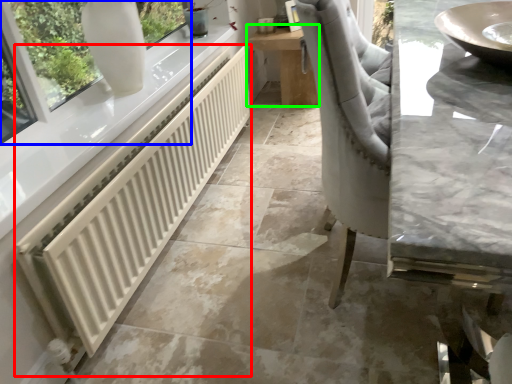
Question: Considering the real-world distances, which object is farthest from radiator (highlighted by a red box)? window (highlighted by a blue box) or table (highlighted by a green box)?

Choices:
 (A) window
 (B) table

Answer: (B)